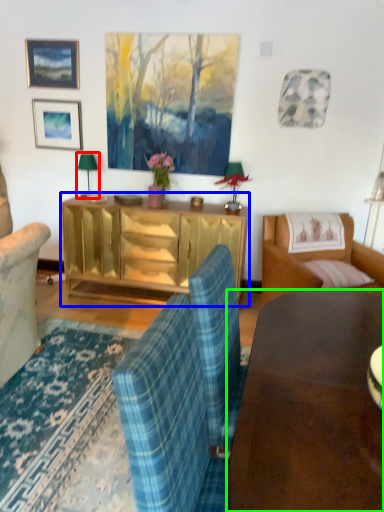
Question: Which object is the closest to the lamp (highlighted by a red box)? Choose among these: cabinetry (highlighted by a blue box) or desk (highlighted by a green box).

Choices:
 (A) cabinetry
 (B) desk

Answer: (A)